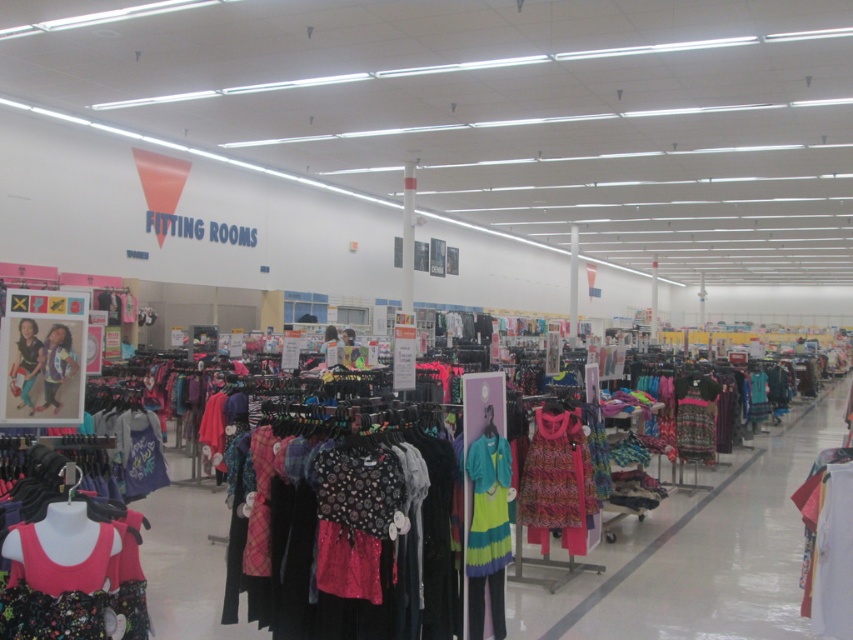
Question: Which point is closer to the camera?

Choices:
 (A) matte black dress at center
 (B) matte pink dress at center
 (C) printed cotton dress at center

Answer: (B)

Question: Can you confirm if shiny sequined top at center is positioned below matte pink dress at center?

Choices:
 (A) yes
 (B) no

Answer: (A)

Question: Which object is farther from the camera taking this photo?

Choices:
 (A) shiny sequined top at center
 (B) matte pink dress at center
 (C) printed cotton dress at center
 (D) matte black dress at center

Answer: (C)

Question: Can you confirm if floral fabric dress at lower left is positioned below matte black dress at center?

Choices:
 (A) no
 (B) yes

Answer: (B)

Question: Is shiny sequined top at center to the right of floral fabric dress at lower left from the viewer's perspective?

Choices:
 (A) no
 (B) yes

Answer: (B)

Question: Which of the following is the farthest from the observer?

Choices:
 (A) matte pink dress at center
 (B) matte black dress at center

Answer: (B)